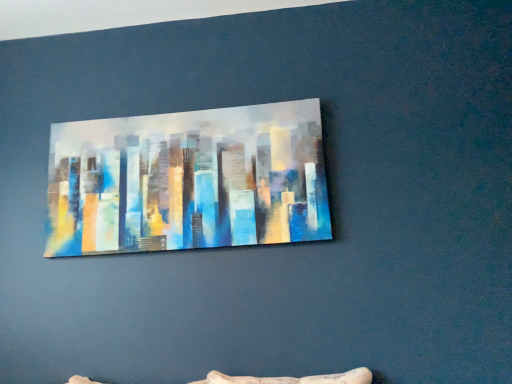
Locate an element on the screen. painted canvas cityscape at center is located at coordinates (188, 180).

Describe the element at coordinates (188, 180) in the screenshot. The image size is (512, 384). I see `painted canvas cityscape at center` at that location.

Locate an element on the screen. The width and height of the screenshot is (512, 384). painted canvas cityscape at center is located at coordinates (188, 180).